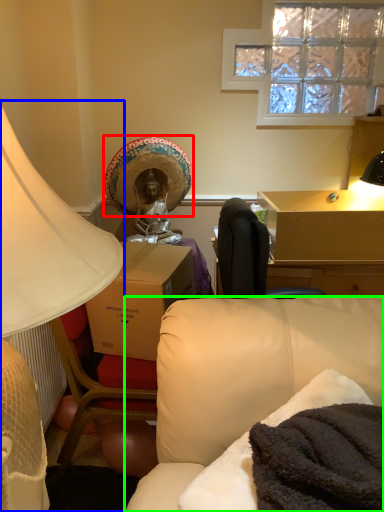
Question: Which object is the farthest from straw hat (highlighted by a red box)? Choose among these: lamp (highlighted by a blue box) or studio couch (highlighted by a green box).

Choices:
 (A) lamp
 (B) studio couch

Answer: (A)